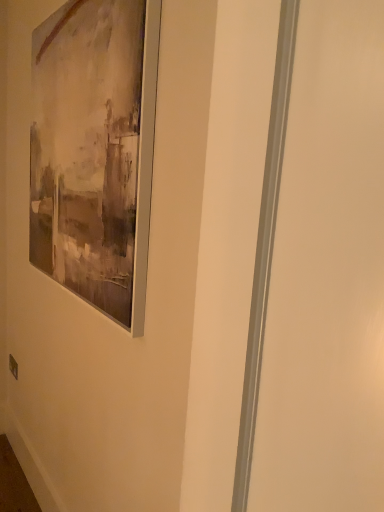
Question: Does matte plastic outlet at lower left have a lesser width compared to matte brown frame at upper left?

Choices:
 (A) yes
 (B) no

Answer: (A)

Question: Can you confirm if matte plastic outlet at lower left is smaller than matte brown frame at upper left?

Choices:
 (A) yes
 (B) no

Answer: (A)

Question: Does matte plastic outlet at lower left have a greater width compared to matte brown frame at upper left?

Choices:
 (A) yes
 (B) no

Answer: (B)

Question: Is the surface of matte plastic outlet at lower left in direct contact with matte brown frame at upper left?

Choices:
 (A) yes
 (B) no

Answer: (B)

Question: Does matte plastic outlet at lower left turn towards matte brown frame at upper left?

Choices:
 (A) no
 (B) yes

Answer: (A)

Question: From a real-world perspective, is matte plastic outlet at lower left below matte brown frame at upper left?

Choices:
 (A) no
 (B) yes

Answer: (B)

Question: Considering the relative sizes of matte brown frame at upper left and matte plastic outlet at lower left in the image provided, is matte brown frame at upper left taller than matte plastic outlet at lower left?

Choices:
 (A) yes
 (B) no

Answer: (A)

Question: Is matte brown frame at upper left to the right of matte plastic outlet at lower left from the viewer's perspective?

Choices:
 (A) no
 (B) yes

Answer: (B)

Question: Does matte brown frame at upper left have a lesser width compared to matte plastic outlet at lower left?

Choices:
 (A) yes
 (B) no

Answer: (B)

Question: Does matte brown frame at upper left come in front of matte plastic outlet at lower left?

Choices:
 (A) no
 (B) yes

Answer: (B)

Question: Is matte brown frame at upper left directly adjacent to matte plastic outlet at lower left?

Choices:
 (A) no
 (B) yes

Answer: (A)

Question: Is matte brown frame at upper left outside of matte plastic outlet at lower left?

Choices:
 (A) yes
 (B) no

Answer: (A)

Question: Considering the positions of matte brown frame at upper left and matte plastic outlet at lower left in the image, is matte brown frame at upper left taller or shorter than matte plastic outlet at lower left?

Choices:
 (A) tall
 (B) short

Answer: (A)